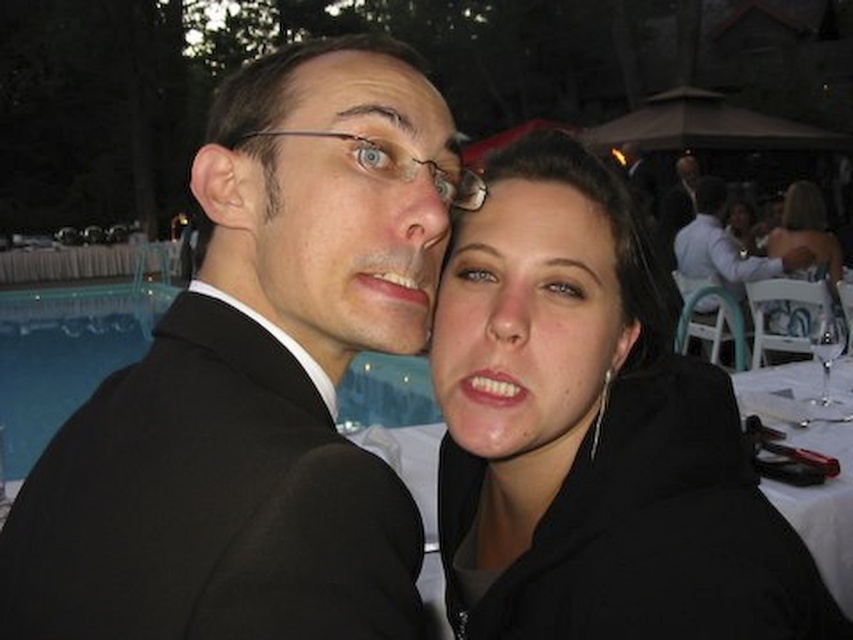
Can you confirm if black matte jacket at center is bigger than matte black suit at center?

Incorrect, black matte jacket at center is not larger than matte black suit at center.

Does black matte jacket at center appear over matte black suit at center?

Actually, black matte jacket at center is below matte black suit at center.

Find the location of `black matte jacket at center`. black matte jacket at center is located at coordinates (593, 433).

Consider the image. Is black matte jacket at center positioned behind blue glass pool at lower left?

No.

Is black matte jacket at center to the left of blue glass pool at lower left from the viewer's perspective?

Incorrect, black matte jacket at center is not on the left side of blue glass pool at lower left.

Does point (596, 440) come in front of point (129, 308)?

Yes, it is in front of point (129, 308).

At what (x,y) coordinates should I click in order to perform the action: click on black matte jacket at center. Please return your answer as a coordinate pair (x, y). Image resolution: width=853 pixels, height=640 pixels. Looking at the image, I should click on (593, 433).

Between white glossy table at lower right and matte black suit at center, which one has more height?

With more height is matte black suit at center.

Looking at this image, does white glossy table at lower right have a lesser height compared to matte black suit at center?

Result: Yes, white glossy table at lower right is shorter than matte black suit at center.

Describe the element at coordinates (810, 449) in the screenshot. I see `white glossy table at lower right` at that location.

Identify the location of white glossy table at lower right. (810, 449).